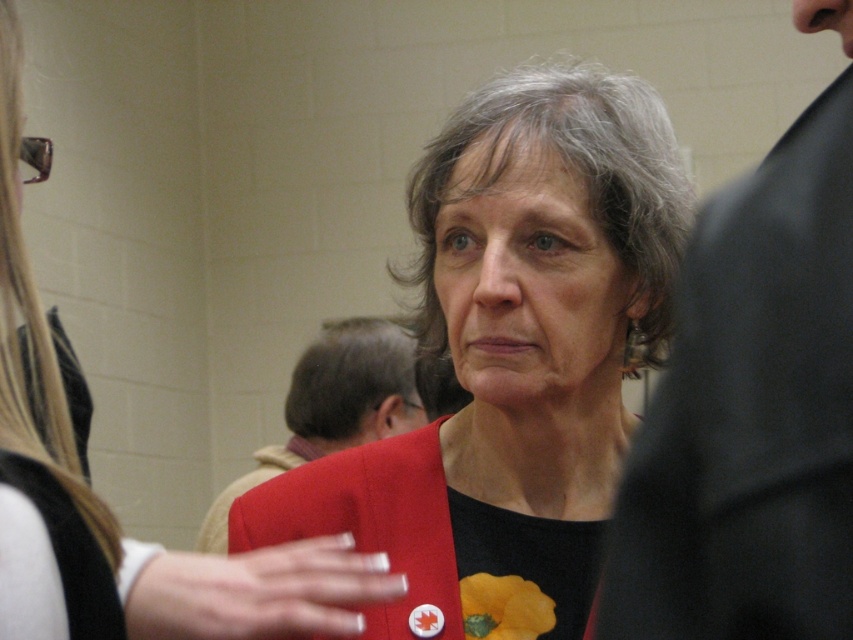
Which is below, matte red jacket at center or matte red coat at center?

matte red coat at center

Looking at this image, is matte red jacket at center wider than matte red coat at center?

Yes.

Between point (480, 625) and point (9, 387), which one is positioned behind?

The point (480, 625) is behind.

The width and height of the screenshot is (853, 640). What are the coordinates of `matte red jacket at center` in the screenshot? It's located at (514, 360).

Who is taller, matte red jacket at center or matte black suit at right?

matte red jacket at center is taller.

You are a GUI agent. You are given a task and a screenshot of the screen. Output one action in this format:
    pyautogui.click(x=<x>, y=<y>)
    Task: Click on the matte red jacket at center
    The width and height of the screenshot is (853, 640).
    Given the screenshot: What is the action you would take?
    pyautogui.click(x=514, y=360)

Consider the image. Can you confirm if matte black suit at right is positioned to the left of matte red coat at center?

Incorrect, matte black suit at right is not on the left side of matte red coat at center.

Which is above, matte black suit at right or matte red coat at center?

Positioned higher is matte black suit at right.

Where is `matte black suit at right`? matte black suit at right is located at coordinates (751, 413).

You are a GUI agent. You are given a task and a screenshot of the screen. Output one action in this format:
    pyautogui.click(x=<x>, y=<y>)
    Task: Click on the matte black suit at right
    The width and height of the screenshot is (853, 640).
    Given the screenshot: What is the action you would take?
    pyautogui.click(x=751, y=413)